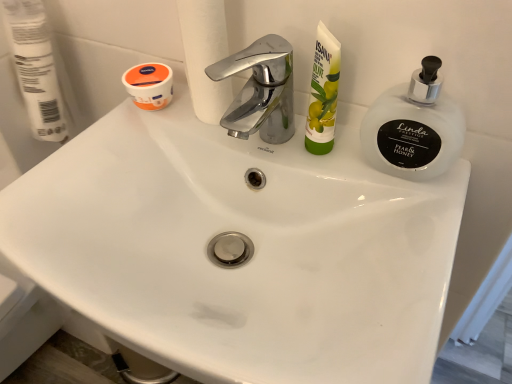
Find the location of a particular element. free space in front of frosted glass soap dispenser at upper right is located at coordinates (404, 260).